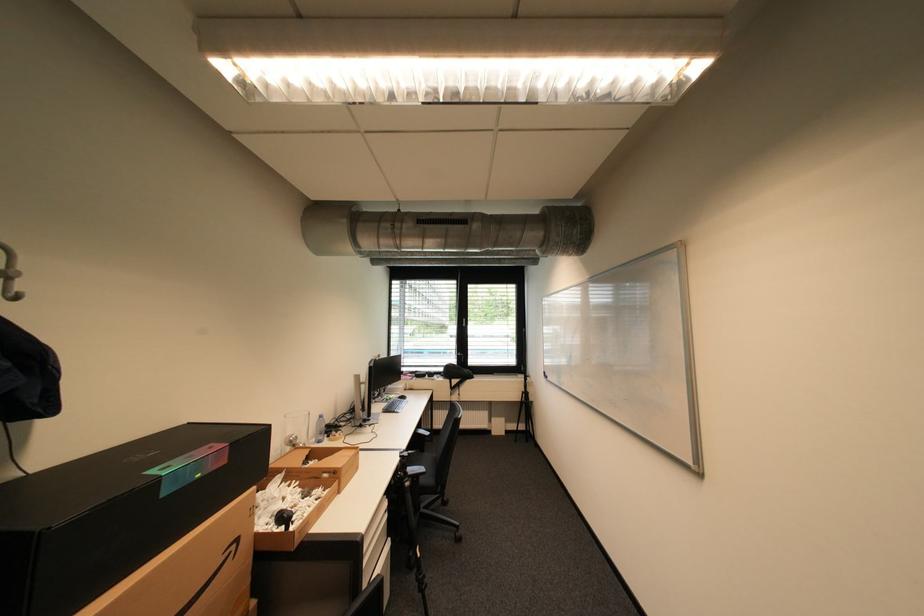
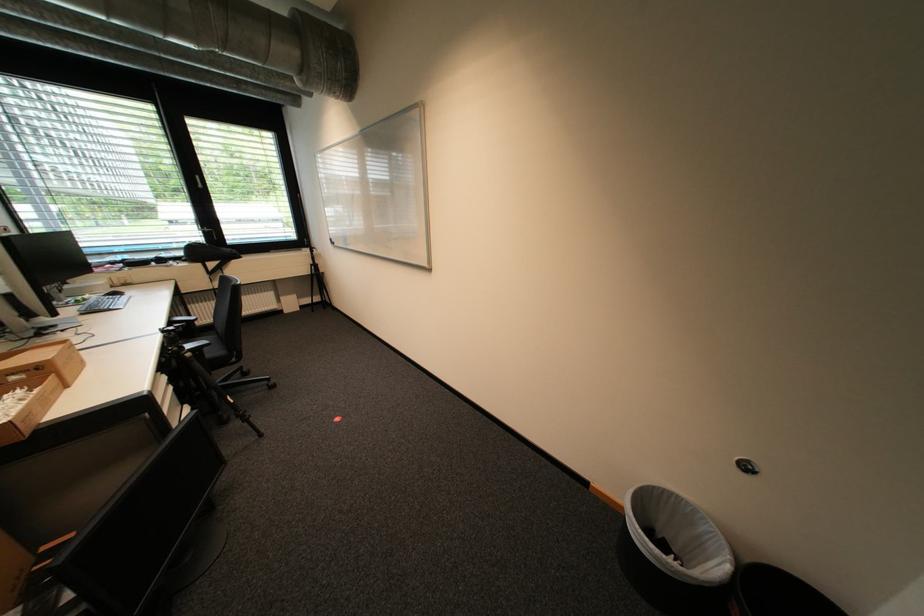
In the second image, find the point that corresponds to the point at 333,472 in the first image.

(20, 375)